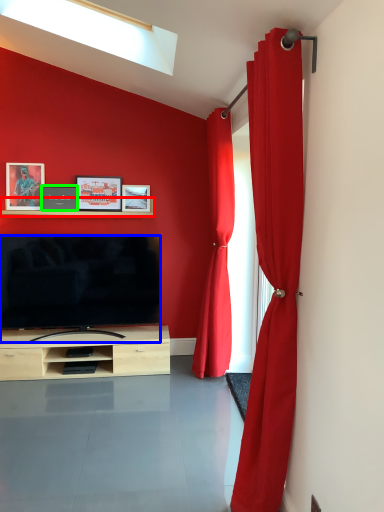
Question: Which is farther away from shelf (highlighted by a red box)? television (highlighted by a blue box) or picture frame (highlighted by a green box)?

Choices:
 (A) television
 (B) picture frame

Answer: (A)